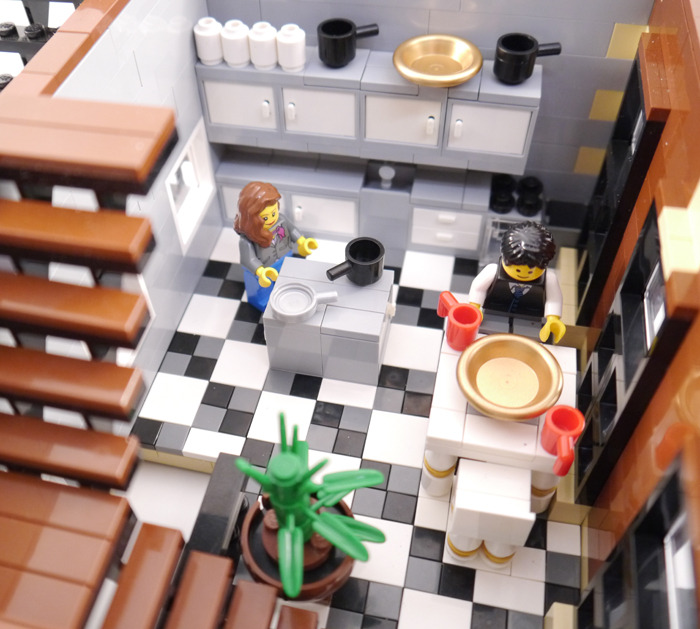
The image size is (700, 629). Identify the location of tiny green artificial houseplant. (295, 502).